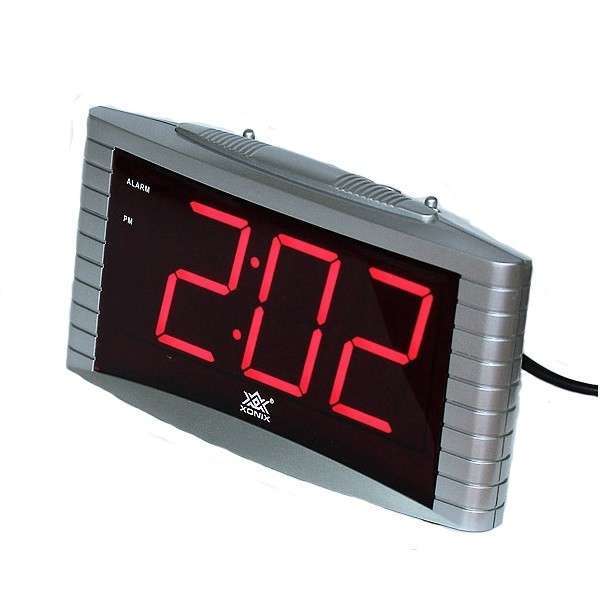
The height and width of the screenshot is (600, 600). What are the coordinates of `1 black cord` in the screenshot? It's located at (579, 382).